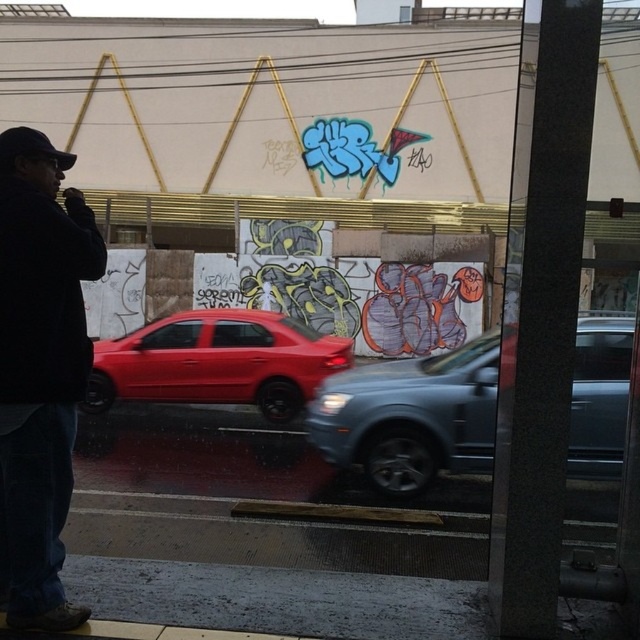
Question: In this image, where is dark blue jacket at left located relative to metallic gray suv at center?

Choices:
 (A) left
 (B) right

Answer: (A)

Question: Which point is closer to the camera?

Choices:
 (A) metallic gray suv at center
 (B) dark blue jacket at left

Answer: (B)

Question: Can you confirm if metallic gray suv at center is positioned below glossy red car at center?

Choices:
 (A) yes
 (B) no

Answer: (A)

Question: Among these points, which one is nearest to the camera?

Choices:
 (A) (65, 596)
 (B) (250, 330)
 (C) (595, 472)

Answer: (A)

Question: Does dark blue jacket at left have a greater width compared to metallic gray suv at center?

Choices:
 (A) no
 (B) yes

Answer: (A)

Question: Which of the following is the closest to the observer?

Choices:
 (A) (33, 550)
 (B) (115, 396)
 (C) (442, 360)

Answer: (A)